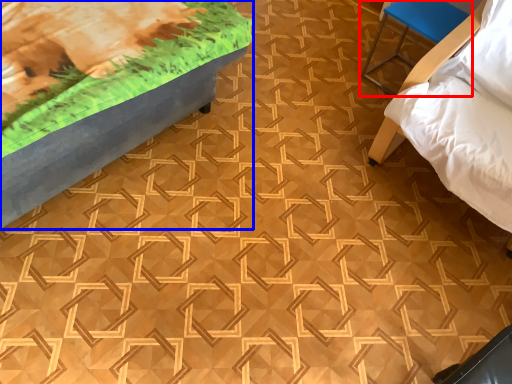
Question: Which point is closer to the camera, furniture (highlighted by a red box) or furniture (highlighted by a blue box)?

Choices:
 (A) furniture
 (B) furniture

Answer: (B)